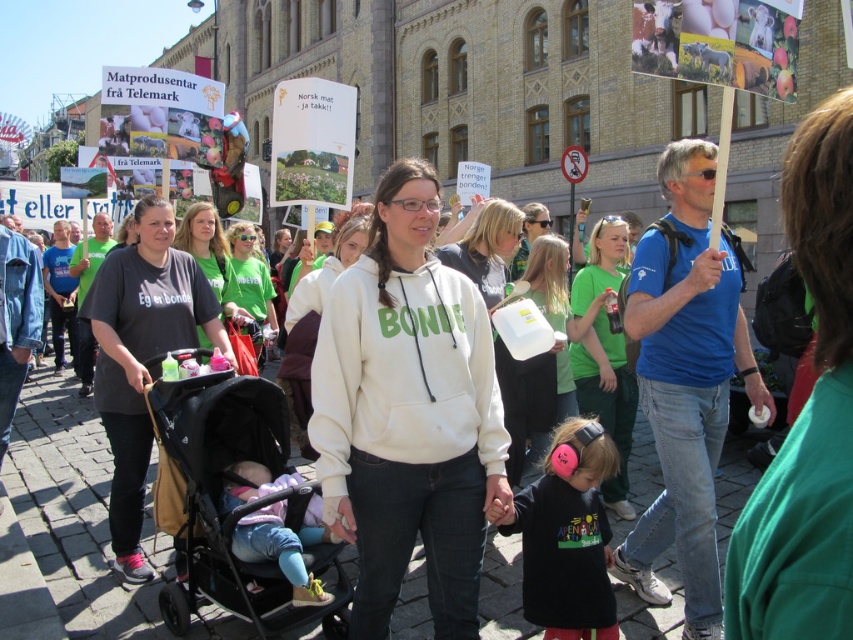
Question: Does black fabric stroller at center-left have a smaller size compared to green cotton t-shirt at center?

Choices:
 (A) yes
 (B) no

Answer: (B)

Question: Does dark gray cotton t-shirt at center come in front of light pink fabric at lower center?

Choices:
 (A) no
 (B) yes

Answer: (A)

Question: Which point is closer to the camera?

Choices:
 (A) (589, 605)
 (B) (263, 486)

Answer: (B)

Question: Estimate the real-world distances between objects in this image. Which object is closer to the white cotton hoodie at center?

Choices:
 (A) dark gray cotton t-shirt at center
 (B) black matte t-shirt at lower center
 (C) green cotton hoodie at center
 (D) green cotton shirt at center

Answer: (B)

Question: Which of the following is the closest to the observer?

Choices:
 (A) tap(618, 392)
 (B) tap(602, 449)
 (C) tap(424, 324)
 (D) tap(544, 300)

Answer: (B)

Question: Can you confirm if black fabric stroller at center-left is positioned to the left of dark gray cotton t-shirt at center?

Choices:
 (A) no
 (B) yes

Answer: (A)